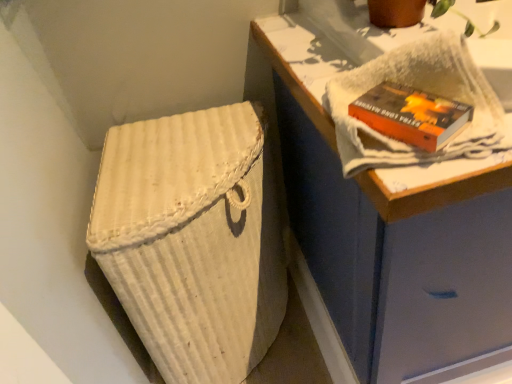
Question: Looking at their shapes, would you say white woven laundry basket at lower left is wider or thinner than orange matte paperback book at upper right?

Choices:
 (A) thin
 (B) wide

Answer: (B)

Question: Would you say white woven laundry basket at lower left is to the left or to the right of orange matte paperback book at upper right in the picture?

Choices:
 (A) left
 (B) right

Answer: (A)

Question: Which is nearer to the orange matte paperback book at upper right?

Choices:
 (A) white woven laundry basket at lower left
 (B) white textured towel at upper right
 (C) white woven basket at lower left

Answer: (B)

Question: Which of these objects is positioned farthest from the orange matte paperback book at upper right?

Choices:
 (A) white textured towel at upper right
 (B) white woven laundry basket at lower left
 (C) white woven basket at lower left

Answer: (B)